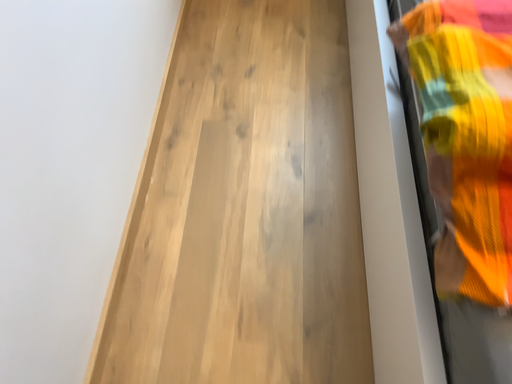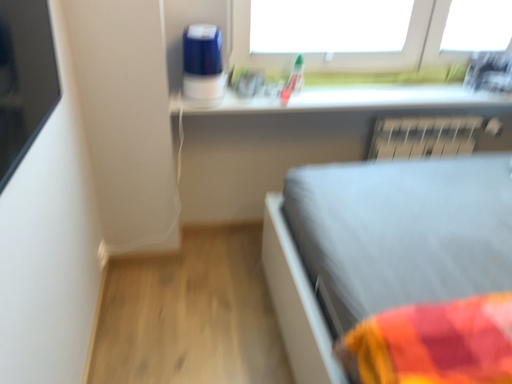
Question: How did the camera likely rotate when shooting the video?

Choices:
 (A) rotated downward
 (B) rotated upward

Answer: (B)